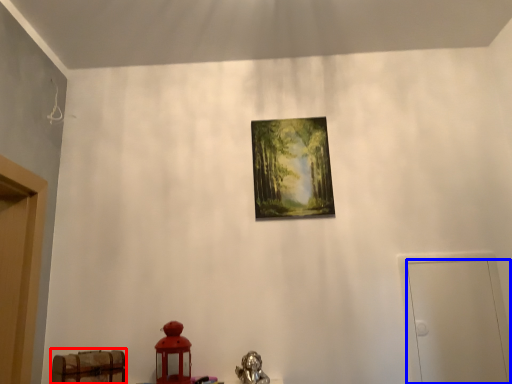
Question: Which object is further to the camera taking this photo, furniture (highlighted by a red box) or door (highlighted by a blue box)?

Choices:
 (A) furniture
 (B) door

Answer: (B)